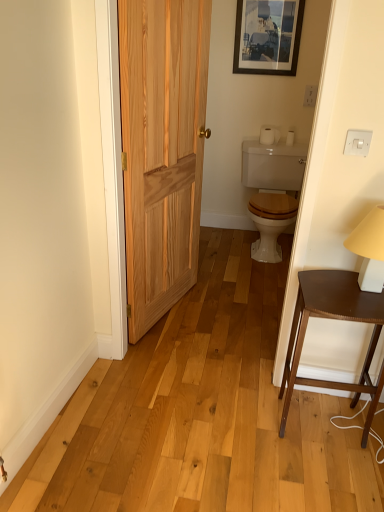
The width and height of the screenshot is (384, 512). I want to click on dark brown wood table at right, so click(x=334, y=319).

Image resolution: width=384 pixels, height=512 pixels. In order to click on white plastic outlet at upper right, placed as the 2th electric outlet when sorted from left to right in this screenshot , I will do `click(310, 95)`.

How much space does white matte toilet paper at upper right, positioned as the 1th toilet paper in right-to-left order, occupy horizontally?

It is 4.06 inches.

In order to click on natural wood door at left in this screenshot , I will do `click(162, 149)`.

Measure the distance between point (299, 174) and camera.

Point (299, 174) and camera are 3.29 meters apart from each other.

Describe the element at coordinates (269, 135) in the screenshot. I see `white matte toilet paper at upper center, which is the 1th toilet paper in left-to-right order` at that location.

What is the approximate width of wooden picture frame at upper center?

wooden picture frame at upper center is 3.42 centimeters in width.

Where is `dark brown wood table at right`? This screenshot has width=384, height=512. dark brown wood table at right is located at coordinates (334, 319).

Is white matte toilet paper at upper center, which is counted as the 2th toilet paper, starting from the right, a part of white plastic outlet at upper right, positioned as the 2th electric outlet in bottom-to-top order?

That's incorrect, white matte toilet paper at upper center, which is counted as the 2th toilet paper, starting from the right, is not inside white plastic outlet at upper right, positioned as the 2th electric outlet in bottom-to-top order.

Is point (310, 105) positioned in front of point (278, 132)?

Yes, it is in front of point (278, 132).

From the image's perspective, count 1st toilet papers downward from the white plastic outlet at upper right, placed as the 2th electric outlet when sorted from left to right, and point to it. Please provide its 2D coordinates.

[(269, 135)]

Are white plastic outlet at upper right, positioned as the 2th electric outlet in bottom-to-top order, and white matte toilet paper at upper center, which is counted as the 2th toilet paper, starting from the right, beside each other?

No, white plastic outlet at upper right, positioned as the 2th electric outlet in bottom-to-top order, is not in contact with white matte toilet paper at upper center, which is counted as the 2th toilet paper, starting from the right.

Locate an element on the screen. electric outlet on the right of white glossy toilet at center is located at coordinates (310, 95).

Which is more to the right, white glossy toilet at center or white plastic outlet at upper right, positioned as the 2th electric outlet in bottom-to-top order?

white plastic outlet at upper right, positioned as the 2th electric outlet in bottom-to-top order.

Can you see white glossy toilet at center touching white plastic outlet at upper right, the first electric outlet positioned from the top?

No, white glossy toilet at center is not in contact with white plastic outlet at upper right, the first electric outlet positioned from the top.

Which of these two, white matte table lamp at right or wooden picture frame at upper center, stands taller?

wooden picture frame at upper center.

Does point (372, 250) appear closer or farther from the camera than point (298, 13)?

Point (372, 250) is positioned closer to the camera compared to point (298, 13).

From a real-world perspective, is white matte table lamp at right positioned above or below wooden picture frame at upper center?

white matte table lamp at right is below wooden picture frame at upper center.

Is white matte table lamp at right next to wooden picture frame at upper center?

No, white matte table lamp at right is not touching wooden picture frame at upper center.

Considering the relative positions of white plastic outlet at upper right, placed as the 2th electric outlet when sorted from left to right, and white matte table lamp at right in the image provided, is white plastic outlet at upper right, placed as the 2th electric outlet when sorted from left to right, in front of white matte table lamp at right?

No, white plastic outlet at upper right, placed as the 2th electric outlet when sorted from left to right, is further to the viewer.

Identify the location of electric outlet lying on the right of white matte table lamp at right. The width and height of the screenshot is (384, 512). (310, 95).

From the image's perspective, is white plastic outlet at upper right, positioned as the 2th electric outlet in bottom-to-top order, positioned above or below white matte table lamp at right?

white plastic outlet at upper right, positioned as the 2th electric outlet in bottom-to-top order, is situated higher than white matte table lamp at right in the image.

Is wooden picture frame at upper center inside the boundaries of dark brown wood table at right, or outside?

wooden picture frame at upper center is not enclosed by dark brown wood table at right.

From the image's perspective, does wooden picture frame at upper center appear lower than dark brown wood table at right?

No.

Considering the relative sizes of wooden picture frame at upper center and dark brown wood table at right in the image provided, is wooden picture frame at upper center taller than dark brown wood table at right?

Incorrect, the height of wooden picture frame at upper center is not larger of that of dark brown wood table at right.

From a real-world perspective, is natural wood door at left positioned over white plastic switch at upper right, positioned as the 1th electric outlet in bottom-to-top order, based on gravity?

No, from a real-world perspective, natural wood door at left is not above white plastic switch at upper right, positioned as the 1th electric outlet in bottom-to-top order.

Is natural wood door at left smaller than white plastic switch at upper right, the second electric outlet from the top?

Incorrect, natural wood door at left is not smaller in size than white plastic switch at upper right, the second electric outlet from the top.

Considering the sizes of natural wood door at left and white plastic switch at upper right, the 1th electric outlet viewed from the left, in the image, is natural wood door at left wider or thinner than white plastic switch at upper right, the 1th electric outlet viewed from the left,?

Considering their sizes, natural wood door at left looks broader than white plastic switch at upper right, the 1th electric outlet viewed from the left.

Can you confirm if natural wood door at left is taller than white plastic switch at upper right, positioned as the 1th electric outlet in bottom-to-top order?

Yes, natural wood door at left is taller than white plastic switch at upper right, positioned as the 1th electric outlet in bottom-to-top order.

Is white plastic outlet at upper right, the first electric outlet positioned from the top, at the back of wooden picture frame at upper center?

That's not correct — wooden picture frame at upper center is not looking away from white plastic outlet at upper right, the first electric outlet positioned from the top.

In the scene shown: Can you tell me how much wooden picture frame at upper center and white plastic outlet at upper right, the first electric outlet positioned from the right, differ in facing direction?

The facing directions of wooden picture frame at upper center and white plastic outlet at upper right, the first electric outlet positioned from the right, are 0.605 degrees apart.

Is wooden picture frame at upper center positioned far away from white plastic outlet at upper right, the first electric outlet positioned from the back?

No, there isn't a large distance between wooden picture frame at upper center and white plastic outlet at upper right, the first electric outlet positioned from the back.

From the image's perspective, is wooden picture frame at upper center above or below white plastic outlet at upper right, the 2th electric outlet viewed from the front?

Clearly, from the image's perspective, wooden picture frame at upper center is above white plastic outlet at upper right, the 2th electric outlet viewed from the front.

Image resolution: width=384 pixels, height=512 pixels. Find the location of `the 2nd toilet paper to the left of the white plastic outlet at upper right, positioned as the 2th electric outlet in bottom-to-top order, counting from the anchor's position`. the 2nd toilet paper to the left of the white plastic outlet at upper right, positioned as the 2th electric outlet in bottom-to-top order, counting from the anchor's position is located at coordinates (269, 135).

The width and height of the screenshot is (384, 512). Identify the location of sink located in front of the white plastic outlet at upper right, placed as the 2th electric outlet when sorted from left to right. (272, 191).

Estimate the real-world distances between objects in this image. Which object is closer to white glossy toilet at center, dark brown wood table at right or natural wood door at left?

natural wood door at left is positioned closer to the anchor white glossy toilet at center.

Which object lies further to the anchor point white matte table lamp at right, white matte toilet paper at upper center, which is the 1th toilet paper in left-to-right order, or white plastic switch at upper right, which is the 2th electric outlet in back-to-front order?

Among the two, white matte toilet paper at upper center, which is the 1th toilet paper in left-to-right order, is located further to white matte table lamp at right.

Based on their spatial positions, is natural wood door at left or white glossy toilet at center closer to white plastic switch at upper right, which is the 1th electric outlet in front-to-back order?

The object closer to white plastic switch at upper right, which is the 1th electric outlet in front-to-back order, is natural wood door at left.

Which object lies nearer to the anchor point white matte toilet paper at upper right, positioned as the 1th toilet paper in right-to-left order, white matte toilet paper at upper center, which is the 1th toilet paper in left-to-right order, or white plastic outlet at upper right, the first electric outlet positioned from the right?

white matte toilet paper at upper center, which is the 1th toilet paper in left-to-right order, is positioned closer to the anchor white matte toilet paper at upper right, positioned as the 1th toilet paper in right-to-left order.

Looking at the image, which one is located further to white matte toilet paper at upper center, which is the 1th toilet paper in left-to-right order, white glossy toilet at center or natural wood door at left?

natural wood door at left lies further to white matte toilet paper at upper center, which is the 1th toilet paper in left-to-right order, than the other object.

Looking at this image, estimate the real-world distances between objects in this image. Which object is further from wooden picture frame at upper center, white plastic switch at upper right, the 1th electric outlet viewed from the left, or white matte toilet paper at upper center, which is counted as the 2th toilet paper, starting from the right?

The object further to wooden picture frame at upper center is white plastic switch at upper right, the 1th electric outlet viewed from the left.

From the image, which object appears to be farther from white plastic outlet at upper right, positioned as the 2th electric outlet in bottom-to-top order, white matte table lamp at right or wooden picture frame at upper center?

The object further to white plastic outlet at upper right, positioned as the 2th electric outlet in bottom-to-top order, is white matte table lamp at right.

Looking at the image, which one is located further to white matte toilet paper at upper center, which is counted as the 2th toilet paper, starting from the right, wooden picture frame at upper center or natural wood door at left?

natural wood door at left is positioned further to the anchor white matte toilet paper at upper center, which is counted as the 2th toilet paper, starting from the right.

What are the coordinates of `toilet paper between white plastic outlet at upper right, the first electric outlet positioned from the back, and white matte toilet paper at upper right, positioned as the 1th toilet paper in right-to-left order, vertically` in the screenshot? It's located at (269, 135).

This screenshot has width=384, height=512. Find the location of `toilet paper between natural wood door at left and white matte toilet paper at upper center, which is counted as the 2th toilet paper, starting from the right, along the z-axis`. toilet paper between natural wood door at left and white matte toilet paper at upper center, which is counted as the 2th toilet paper, starting from the right, along the z-axis is located at coordinates (290, 138).

The height and width of the screenshot is (512, 384). I want to click on electric outlet between dark brown wood table at right and white glossy toilet at center along the z-axis, so click(357, 142).

The height and width of the screenshot is (512, 384). In order to click on electric outlet located between white matte table lamp at right and white glossy toilet at center in the depth direction in this screenshot , I will do `click(357, 142)`.